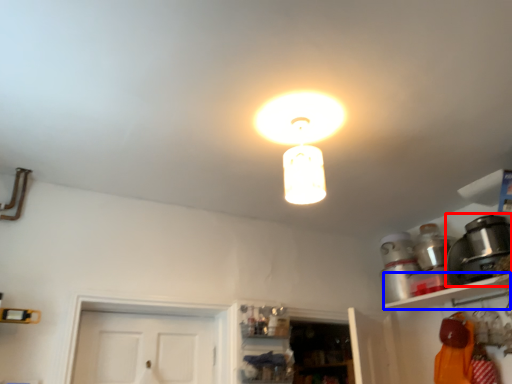
Question: Which object is further to the camera taking this photo, appliance (highlighted by a red box) or shelf (highlighted by a blue box)?

Choices:
 (A) appliance
 (B) shelf

Answer: (A)